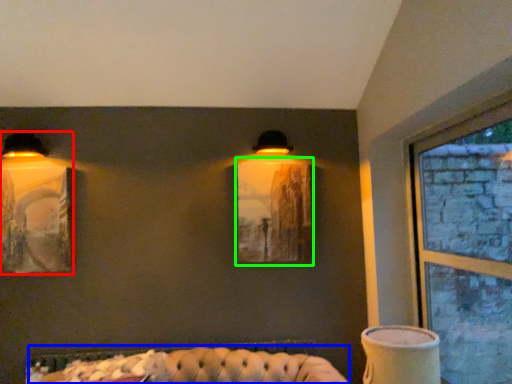
Question: Considering the real-world distances, which object is closest to lamp (highlighted by a red box)? couch (highlighted by a blue box) or picture frame (highlighted by a green box).

Choices:
 (A) couch
 (B) picture frame

Answer: (A)